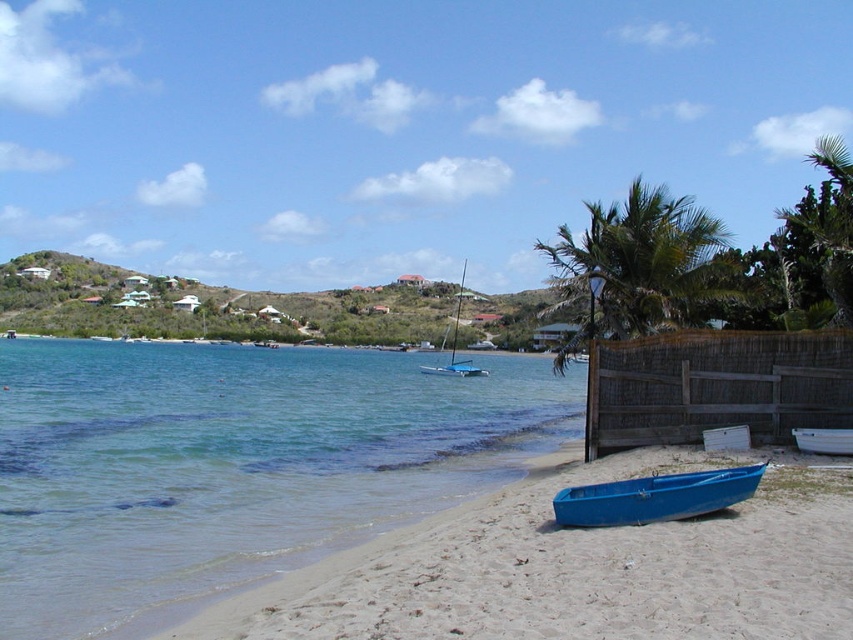
Question: Which object appears closest to the camera in this image?

Choices:
 (A) clear blue water at lower left
 (B) smooth sand at lower right
 (C) white plastic boat at lower right
 (D) green leafy palm tree at center-right

Answer: (B)

Question: Is smooth sand at lower right positioned at the back of white plastic boat at lower right?

Choices:
 (A) no
 (B) yes

Answer: (A)

Question: Is clear blue water at lower left bigger than green leafy palm tree at center-right?

Choices:
 (A) no
 (B) yes

Answer: (A)

Question: Which object is closer to the camera taking this photo?

Choices:
 (A) smooth sand at lower right
 (B) green leafy palm tree at center-right
 (C) white plastic boat at lower right

Answer: (A)

Question: Which point appears farthest from the camera in this image?

Choices:
 (A) (161, 538)
 (B) (657, 250)
 (C) (807, 445)
 (D) (724, 499)

Answer: (B)

Question: Does blue plastic canoe at lower right lie in front of blue plastic sailboat at center?

Choices:
 (A) yes
 (B) no

Answer: (A)